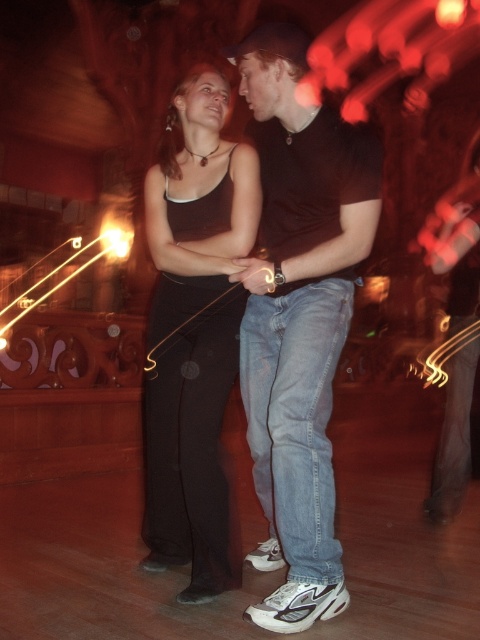
You are at a party and need to find someone wearing denim jeans at center. According to the image coordinates, where exactly should you look to find them?

The denim jeans at center are located at the 2D coordinates point (299,317).

You are organizing a clothing donation drive and need to categorize items based on their size. You have two items in front of you, the denim jeans at center and the matte black tank top at center. Which item is bigger in size?

The denim jeans at center is larger in size than the matte black tank top at center.

You are a photographer trying to capture a candid shot of the matte black tank top at center without including the denim jeans at center in the frame. Based on their positions, is this possible?

The denim jeans at center is in front of matte black tank top at center, so the denim jeans at center would block the view of the matte black tank top at center. Therefore, it is not possible to capture the matte black tank top at center without including the denim jeans at center in the frame.